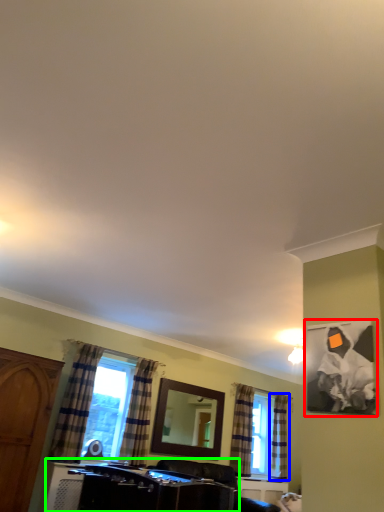
Question: Based on their relative distances, which object is farther from picture frame (highlighted by a red box)? Choose from curtain (highlighted by a blue box) and vanity (highlighted by a green box).

Choices:
 (A) curtain
 (B) vanity

Answer: (A)